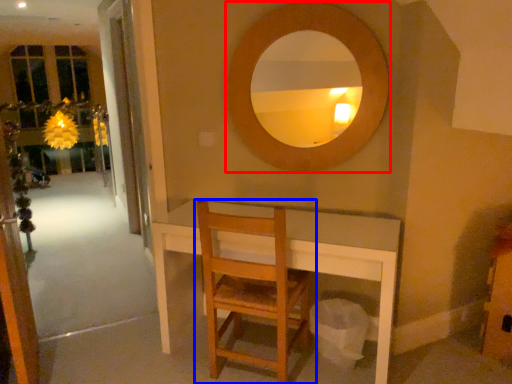
Question: Which of the following is the closest to the observer, mirror (highlighted by a red box) or chair (highlighted by a blue box)?

Choices:
 (A) mirror
 (B) chair

Answer: (B)